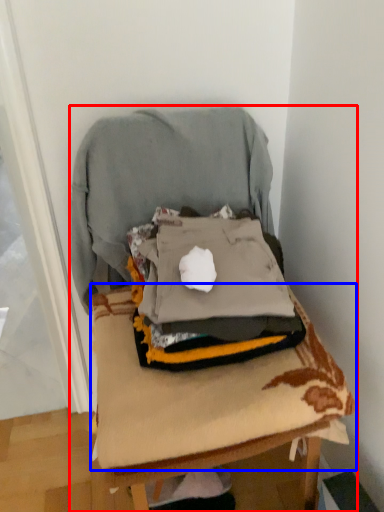
Question: Which object appears farthest to the camera in this image, furniture (highlighted by a red box) or sheet (highlighted by a blue box)?

Choices:
 (A) furniture
 (B) sheet

Answer: (B)